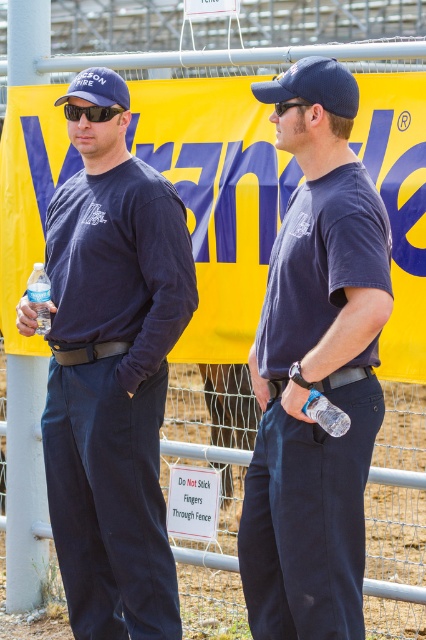
Measure the distance between clear plastic water bottle at lower center and black plastic goggles at center.

The distance of clear plastic water bottle at lower center from black plastic goggles at center is 1.13 meters.

Does clear plastic water bottle at lower center appear under black plastic goggles at center?

Yes.

Which is behind, point (340, 433) or point (282, 109)?

Point (282, 109)

At what (x,y) coordinates should I click in order to perform the action: click on clear plastic water bottle at lower center. Please return your answer as a coordinate pair (x, y). This screenshot has height=640, width=426. Looking at the image, I should click on (325, 413).

Locate an element on the screen. This screenshot has width=426, height=640. matte blue uniform at center is located at coordinates click(x=316, y=371).

Between point (305, 419) and point (411, 547), which one is positioned in front?

Point (305, 419) is more forward.

Image resolution: width=426 pixels, height=640 pixels. What do you see at coordinates (316, 371) in the screenshot? I see `matte blue uniform at center` at bounding box center [316, 371].

The width and height of the screenshot is (426, 640). I want to click on matte blue uniform at center, so click(x=316, y=371).

Which of these two, blue mesh baseball cap at upper center or clear plastic bottle at left, stands taller?

With more height is clear plastic bottle at left.

Does point (302, 80) come closer to viewer compared to point (34, 291)?

Yes, it is.

Locate an element on the screen. blue mesh baseball cap at upper center is located at coordinates (313, 84).